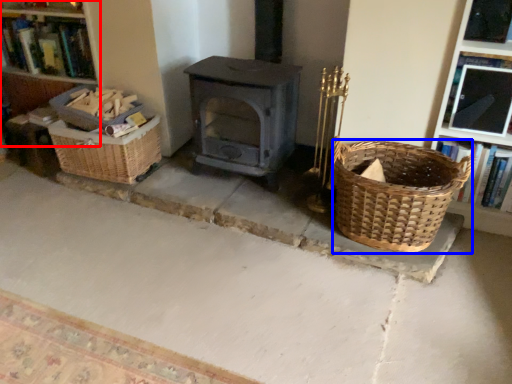
Question: Which object appears closest to the camera in this image, bookshelf (highlighted by a red box) or basket (highlighted by a blue box)?

Choices:
 (A) bookshelf
 (B) basket

Answer: (B)